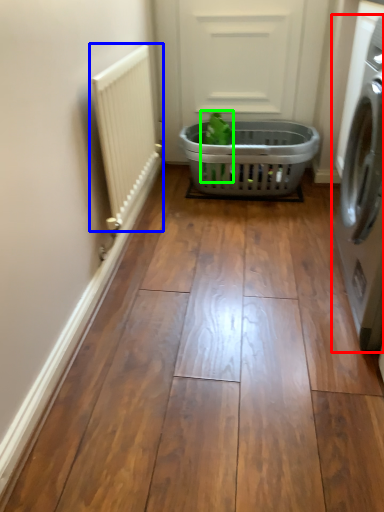
Question: Based on their relative distances, which object is nearer to washing machine (highlighted by a red box)? Choose from radiator (highlighted by a blue box) and plant (highlighted by a green box).

Choices:
 (A) radiator
 (B) plant

Answer: (A)